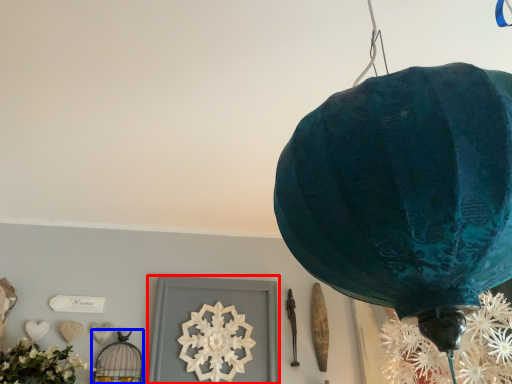
Question: Which point is further to the camera, picture frame (highlighted by a red box) or lamp (highlighted by a blue box)?

Choices:
 (A) picture frame
 (B) lamp

Answer: (A)